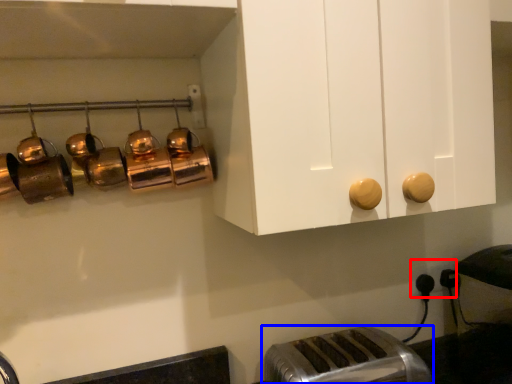
Question: Which object appears closest to the camera in this image, electric outlet (highlighted by a red box) or toaster (highlighted by a blue box)?

Choices:
 (A) electric outlet
 (B) toaster

Answer: (B)